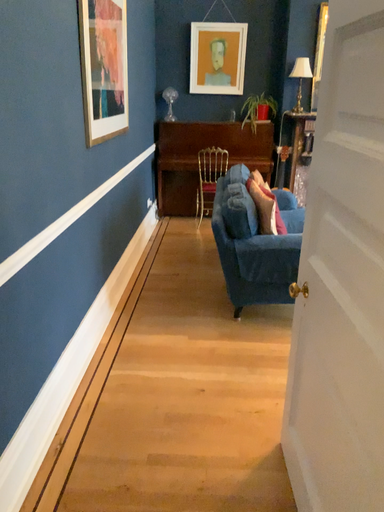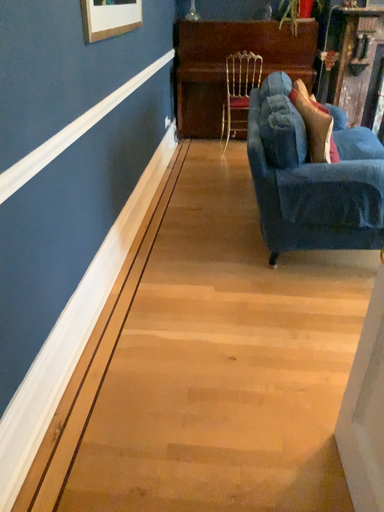
Question: Which way did the camera rotate in the video?

Choices:
 (A) rotated upward
 (B) rotated downward

Answer: (B)